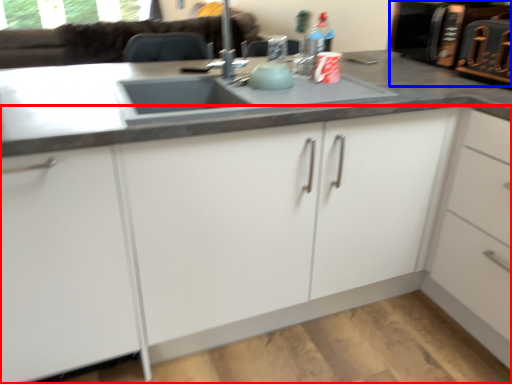
Question: Which object is further to the camera taking this photo, cabinetry (highlighted by a red box) or appliance (highlighted by a blue box)?

Choices:
 (A) cabinetry
 (B) appliance

Answer: (B)